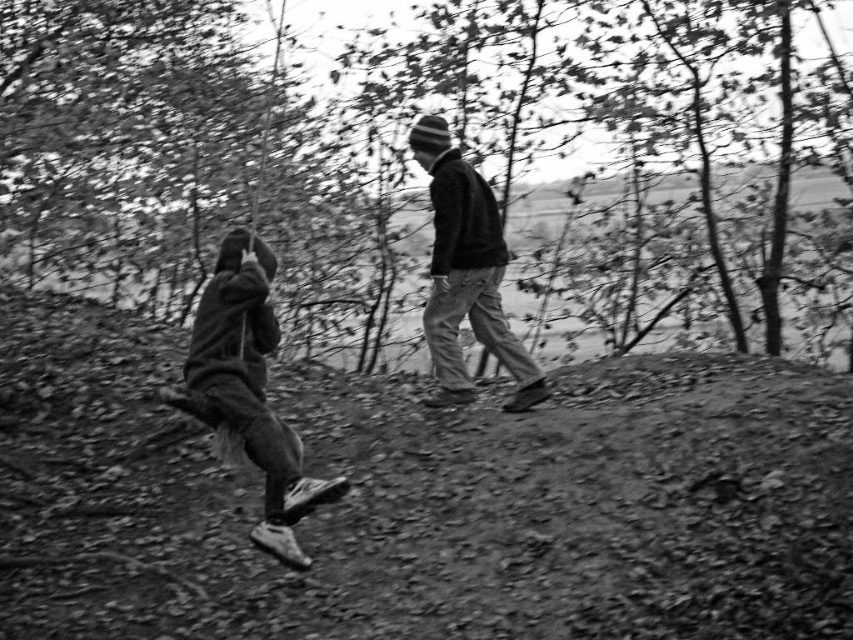
Can you confirm if smooth bark tree at upper center is shorter than knit cap at center?

No, smooth bark tree at upper center is not shorter than knit cap at center.

Does smooth bark tree at upper center have a larger size compared to knit cap at center?

Yes, smooth bark tree at upper center is bigger than knit cap at center.

This screenshot has height=640, width=853. I want to click on smooth bark tree at upper center, so click(x=407, y=154).

Which is more to the right, smooth bark tree at upper center or dark gray fleece jacket at lower left?

smooth bark tree at upper center

This screenshot has height=640, width=853. I want to click on smooth bark tree at upper center, so click(407, 154).

Between point (780, 224) and point (192, 404), which one is positioned in front?

Point (192, 404) is more forward.

Where is `smooth bark tree at upper center`? The width and height of the screenshot is (853, 640). smooth bark tree at upper center is located at coordinates (407, 154).

Which of these two, dark gray fleece jacket at lower left or knit cap at center, stands shorter?

With less height is dark gray fleece jacket at lower left.

Does dark gray fleece jacket at lower left appear under knit cap at center?

Indeed, dark gray fleece jacket at lower left is positioned under knit cap at center.

Where is `dark gray fleece jacket at lower left`? The height and width of the screenshot is (640, 853). dark gray fleece jacket at lower left is located at coordinates (248, 388).

Locate an element on the screen. Image resolution: width=853 pixels, height=640 pixels. dark gray fleece jacket at lower left is located at coordinates (248, 388).